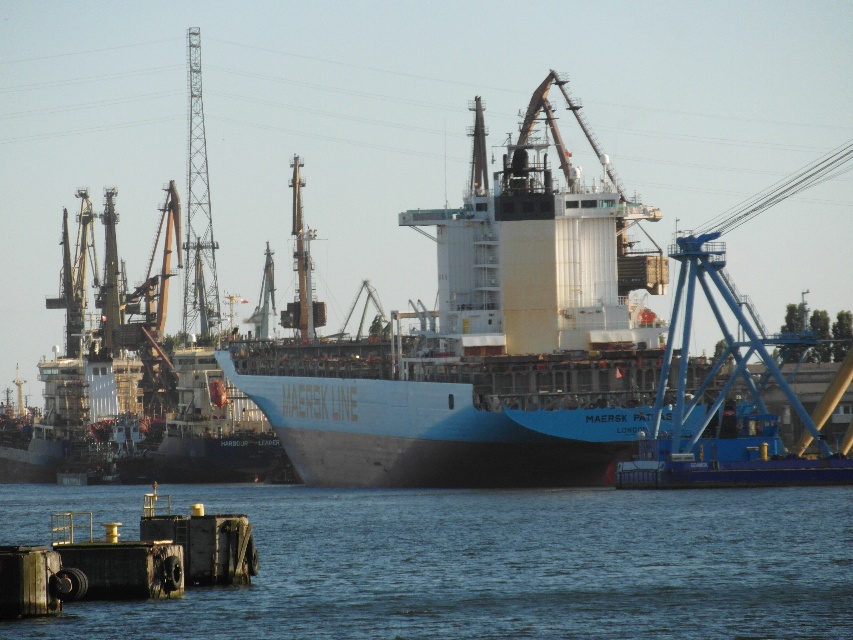
You are a tugboat operator trying to navigate through the port. You need to move from the blue water at lower left to the white matte cargo ship at center. Is there enough space between them for your tugboat, which is 20 meters long?

The distance between the blue water at lower left and the white matte cargo ship at center is 25.79 meters. Since your tugboat is 20 meters long, there is sufficient space to navigate between them.